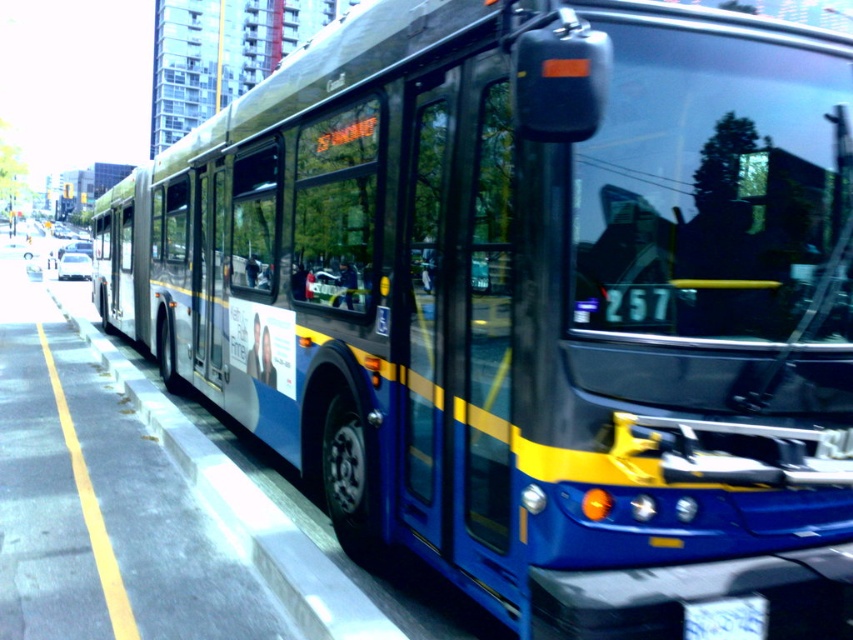
How distant is concrete curb at lower left from white plastic license plate at center?

concrete curb at lower left is 1.96 meters away from white plastic license plate at center.

Who is positioned more to the right, concrete curb at lower left or white plastic license plate at center?

Positioned to the right is white plastic license plate at center.

Is point (303, 593) positioned behind point (752, 612)?

Yes, it is behind point (752, 612).

This screenshot has height=640, width=853. I want to click on concrete curb at lower left, so click(x=238, y=500).